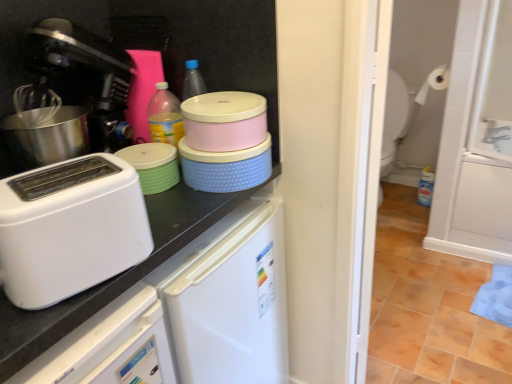
Find the location of a particular element. blue glossy bottle at lower right is located at coordinates (426, 187).

The height and width of the screenshot is (384, 512). What are the coordinates of `green matte container at center` in the screenshot? It's located at (153, 165).

From the image's perspective, is white matte countertop at upper left located above or below white matte toilet paper at upper right?

white matte countertop at upper left is situated lower than white matte toilet paper at upper right in the image.

In the scene shown: Is white matte countertop at upper left spatially inside white matte toilet paper at upper right, or outside of it?

white matte countertop at upper left is located beyond the bounds of white matte toilet paper at upper right.

Can you confirm if white matte countertop at upper left is positioned to the left of white matte toilet paper at upper right?

Yes, white matte countertop at upper left is to the left of white matte toilet paper at upper right.

From a real-world perspective, is white matte countertop at upper left located beneath white matte toilet paper at upper right?

Yes, from a real-world perspective, white matte countertop at upper left is below white matte toilet paper at upper right.

Looking at this image, considering the relative positions of blue glossy bottle at lower right and white matte countertop at upper left in the image provided, is blue glossy bottle at lower right behind white matte countertop at upper left?

Yes, the depth of blue glossy bottle at lower right is greater than that of white matte countertop at upper left.

Which of these two, blue glossy bottle at lower right or white matte countertop at upper left, is wider?

white matte countertop at upper left.

Locate an element on the screen. bottle below the white matte countertop at upper left (from a real-world perspective) is located at coordinates (426, 187).

Are blue glossy bottle at lower right and white matte countertop at upper left making contact?

No, blue glossy bottle at lower right is not beside white matte countertop at upper left.

Is white glossy screen door at right to the left of blue glossy bottle at lower right from the viewer's perspective?

Correct, you'll find white glossy screen door at right to the left of blue glossy bottle at lower right.

Is the surface of white glossy screen door at right in direct contact with blue glossy bottle at lower right?

white glossy screen door at right is not next to blue glossy bottle at lower right, and they're not touching.

How many degrees apart are the facing directions of white glossy screen door at right and blue glossy bottle at lower right?

4.82 degrees.

Which of these two, white glossy screen door at right or blue glossy bottle at lower right, stands taller?

With more height is white glossy screen door at right.

Is white glossy screen door at right with white plastic toaster at left?

No, white glossy screen door at right is not in contact with white plastic toaster at left.

Locate an element on the screen. This screenshot has width=512, height=384. home appliance that is below the white glossy screen door at right (from the image's perspective) is located at coordinates (70, 228).

Which of these two, white glossy screen door at right or white plastic toaster at left, is bigger?

Result: Bigger between the two is white glossy screen door at right.

Is white glossy screen door at right oriented away from white plastic toaster at left?

No, white glossy screen door at right is not facing away from white plastic toaster at left.

Can you confirm if green matte container at center is taller than white glossy screen door at right?

In fact, green matte container at center may be shorter than white glossy screen door at right.

Which object is closer to the camera taking this photo, green matte container at center or white glossy screen door at right?

green matte container at center.

Does green matte container at center have a greater width compared to white glossy screen door at right?

Correct, the width of green matte container at center exceeds that of white glossy screen door at right.

How many degrees apart are the facing directions of green matte container at center and white glossy screen door at right?

59.1 degrees.

Can you confirm if green matte container at center is positioned to the left of white matte toilet paper at upper right?

Indeed, green matte container at center is positioned on the left side of white matte toilet paper at upper right.

Would you say white matte toilet paper at upper right is part of green matte container at center's contents?

No, white matte toilet paper at upper right is located outside of green matte container at center.

Could you tell me if green matte container at center is turned towards white matte toilet paper at upper right?

No, green matte container at center is not oriented towards white matte toilet paper at upper right.

Is there a large distance between white plastic toaster at left and green matte container at center?

No, there isn't a large distance between white plastic toaster at left and green matte container at center.

Can you confirm if white plastic toaster at left is positioned to the left of green matte container at center?

Indeed, white plastic toaster at left is positioned on the left side of green matte container at center.

Which object is closer to the camera, white plastic toaster at left or green matte container at center?

white plastic toaster at left is in front.

Looking at this image, can you tell me how much white plastic toaster at left and green matte container at center differ in facing direction?

white plastic toaster at left and green matte container at center are facing 11.2 degrees away from each other.

Where is `toilet paper that appears above the white matte countertop at upper left (from the image's perspective)`? toilet paper that appears above the white matte countertop at upper left (from the image's perspective) is located at coordinates (434, 83).

Locate an element on the screen. The height and width of the screenshot is (384, 512). bottle on the right side of white matte countertop at upper left is located at coordinates (426, 187).

Estimate the real-world distances between objects in this image. Which object is further from white plastic toaster at left, blue glossy bottle at lower right or white glossy screen door at right?

blue glossy bottle at lower right.

From the image, which object appears to be farther from white glossy screen door at right, blue glossy bottle at lower right or white matte toilet paper at upper right?

blue glossy bottle at lower right lies further to white glossy screen door at right than the other object.

Considering their positions, is white glossy screen door at right positioned closer to white matte toilet paper at upper right than green matte container at center?

The object closer to white matte toilet paper at upper right is white glossy screen door at right.

In the scene shown: From the image, which object appears to be farther from white glossy screen door at right, white matte countertop at upper left or white plastic toaster at left?

Based on the image, white plastic toaster at left appears to be further to white glossy screen door at right.

Looking at the image, which one is located closer to green matte container at center, white glossy screen door at right or black plastic coffee machine at left?

black plastic coffee machine at left is positioned closer to the anchor green matte container at center.

From the image, which object appears to be farther from white matte countertop at upper left, blue glossy bottle at lower right or white plastic toaster at left?

The object further to white matte countertop at upper left is blue glossy bottle at lower right.

From the image, which object appears to be farther from white matte toilet paper at upper right, white matte countertop at upper left or blue glossy bottle at lower right?

The object further to white matte toilet paper at upper right is white matte countertop at upper left.

Estimate the real-world distances between objects in this image. Which object is further from blue glossy bottle at lower right, green matte container at center or white matte toilet paper at upper right?

green matte container at center is positioned further to the anchor blue glossy bottle at lower right.

You are a GUI agent. You are given a task and a screenshot of the screen. Output one action in this format:
    pyautogui.click(x=<x>, y=<y>)
    Task: Click on the coffee machine between white plastic toaster at left and blue glossy bottle at lower right in the front-back direction
    The height and width of the screenshot is (384, 512).
    Given the screenshot: What is the action you would take?
    pyautogui.click(x=82, y=77)

I want to click on appliance positioned between white plastic toaster at left and white matte toilet paper at upper right from near to far, so click(153, 165).

You are a GUI agent. You are given a task and a screenshot of the screen. Output one action in this format:
    pyautogui.click(x=<x>, y=<y>)
    Task: Click on the screen door between black plastic coffee machine at left and blue glossy bottle at lower right in the horizontal direction
    
    Given the screenshot: What is the action you would take?
    pyautogui.click(x=484, y=135)

The height and width of the screenshot is (384, 512). Find the location of `appliance between white matte countertop at upper left and blue glossy bottle at lower right along the z-axis`. appliance between white matte countertop at upper left and blue glossy bottle at lower right along the z-axis is located at coordinates (153, 165).